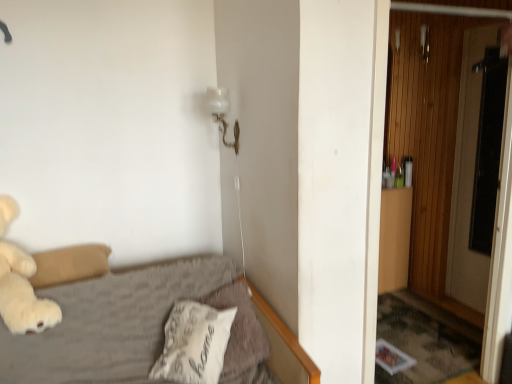
Question: Does white glass lamp at upper center have a lesser width compared to white soft pillow at lower center, which appears as the second pillow when viewed from the left?

Choices:
 (A) no
 (B) yes

Answer: (B)

Question: Is white glass lamp at upper center aimed at white soft pillow at lower center, which appears as the second pillow when viewed from the left?

Choices:
 (A) yes
 (B) no

Answer: (B)

Question: Can you confirm if white glass lamp at upper center is positioned to the right of white soft pillow at lower center, which is the 1th pillow from right to left?

Choices:
 (A) yes
 (B) no

Answer: (B)

Question: From the image's perspective, is white glass lamp at upper center below white soft pillow at lower center, which is the 1th pillow from right to left?

Choices:
 (A) yes
 (B) no

Answer: (B)

Question: Is white glass lamp at upper center closer to camera compared to white soft pillow at lower center, which appears as the second pillow when viewed from the left?

Choices:
 (A) no
 (B) yes

Answer: (A)

Question: From the image's perspective, relative to transparent glass screen door at right, is wooden at right above or below?

Choices:
 (A) above
 (B) below

Answer: (B)

Question: In terms of width, does wooden at right look wider or thinner when compared to transparent glass screen door at right?

Choices:
 (A) wide
 (B) thin

Answer: (B)

Question: Is point (411, 109) positioned closer to the camera than point (502, 92)?

Choices:
 (A) closer
 (B) farther

Answer: (B)

Question: From a real-world perspective, is wooden at right above or below transparent glass screen door at right?

Choices:
 (A) above
 (B) below

Answer: (B)

Question: Considering the positions of white soft pillow at lower center, the 2th pillow from the right, and white plush teddy bear at left in the image, is white soft pillow at lower center, the 2th pillow from the right, taller or shorter than white plush teddy bear at left?

Choices:
 (A) short
 (B) tall

Answer: (A)

Question: Considering the positions of point (210, 339) and point (3, 261), is point (210, 339) closer or farther from the camera than point (3, 261)?

Choices:
 (A) farther
 (B) closer

Answer: (B)

Question: From a real-world perspective, is white soft pillow at lower center, the 1th pillow when ordered from left to right, above or below white plush teddy bear at left?

Choices:
 (A) above
 (B) below

Answer: (B)

Question: Based on their sizes in the image, would you say white soft pillow at lower center, the 2th pillow from the right, is bigger or smaller than white plush teddy bear at left?

Choices:
 (A) big
 (B) small

Answer: (B)

Question: Is point (221, 104) closer or farther from the camera than point (208, 311)?

Choices:
 (A) farther
 (B) closer

Answer: (A)

Question: Relative to white soft pillow at lower center, the 1th pillow when ordered from left to right, is white glass lamp at upper center in front or behind?

Choices:
 (A) front
 (B) behind

Answer: (B)